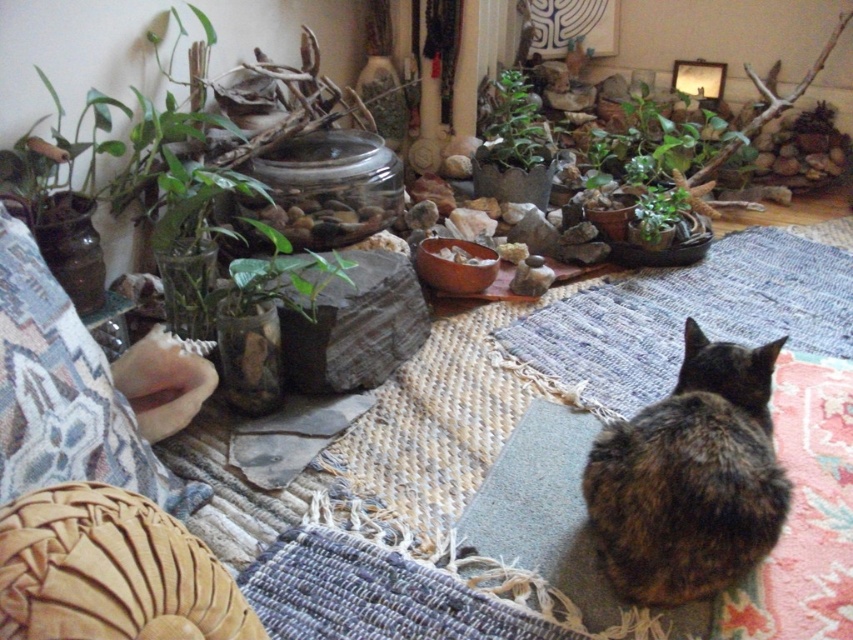
You are a delivery robot that is 1.5 meters tall. You need to move from the entrance to the sofa in the living room. There is a woven fabric pillow at lower left and a green leafy plant at center in your path. Can you pass between them without bending down?

The distance between the woven fabric pillow at lower left and the green leafy plant at center is 1.70 meters. Since the robot is 1.5 meters tall, it can pass between them without needing to bend down as the space is sufficient in height. However, the description provided does not mention the height of the objects, so we can only confirm the horizontal distance allows passage.

You are standing in the room and want to place a small plant exactly at point (x=849, y=301). The plant requires a spot that is at least 2 meters away from the camera to ensure proper growth. Is this point suitable?

The distance of point (x=849, y=301) from the camera is 2.53 meters, which is more than the required 2 meters. Therefore, this point is suitable for placing the plant.

You are trying to find a place to put your new plant stand. You see the blue woven mat at lower right and the green leafy plant at center. Which object is located beneath the other?

The blue woven mat at lower right is positioned under green leafy plant at center, so the mat is beneath the plant.